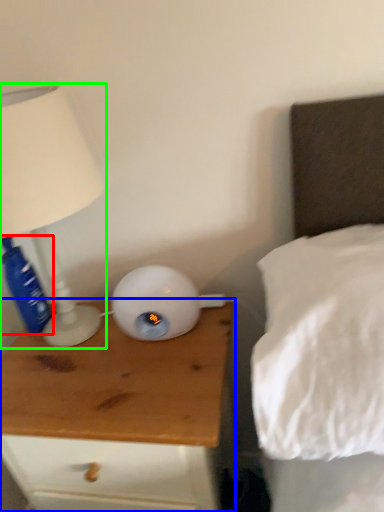
Question: Based on their relative distances, which object is farther from bottle (highlighted by a red box)? Choose from nightstand (highlighted by a blue box) and lamp (highlighted by a green box).

Choices:
 (A) nightstand
 (B) lamp

Answer: (A)